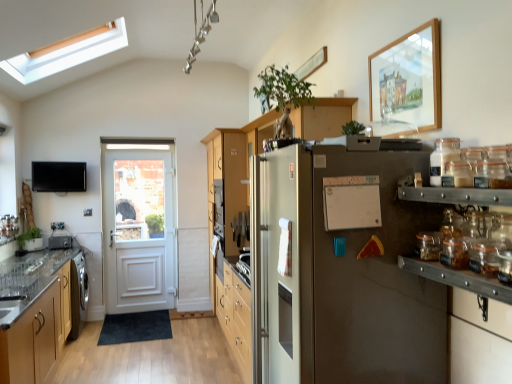
Question: Is clear glass jar at right, which is counted as the 1th glass jar, starting from the bottom, bigger or smaller than clear glass door at left?

Choices:
 (A) small
 (B) big

Answer: (A)

Question: Would you say clear glass jar at right, the second glass jar in the top-to-bottom sequence, is inside or outside clear glass door at left?

Choices:
 (A) outside
 (B) inside

Answer: (A)

Question: Based on their relative distances, which object is nearer to the metallic silver toaster at left?

Choices:
 (A) wooden picture frame at upper right
 (B) green matte plant at left
 (C) clear glass door at left
 (D) white matte bulletin board at center
 (E) wooden cabinet at left

Answer: (B)

Question: Estimate the real-world distances between objects in this image. Which object is closer to the clear glass door at left?

Choices:
 (A) metallic silver toaster at left
 (B) wooden cabinet at left
 (C) white matte bulletin board at center
 (D) green matte plant at left
 (E) wooden picture frame at upper right

Answer: (A)